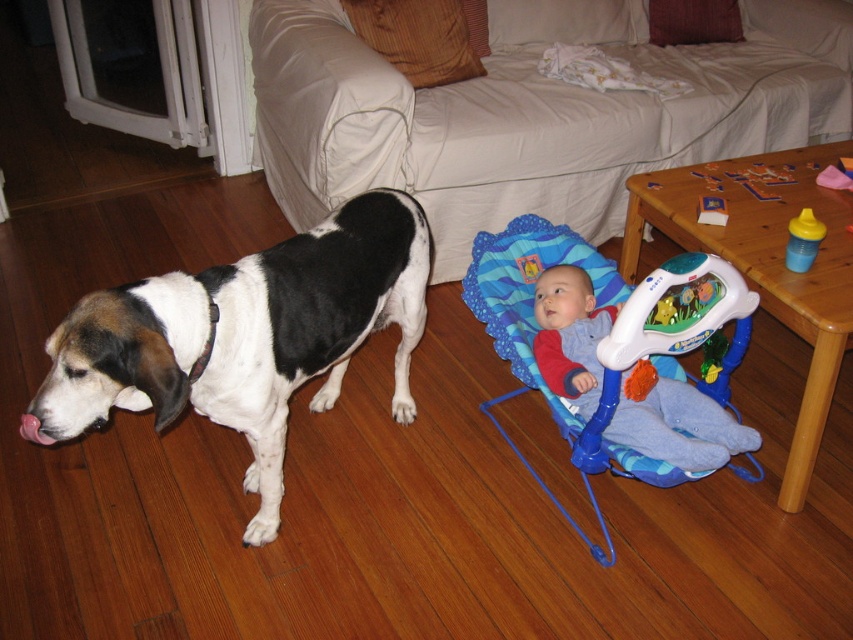
Who is taller, blue plastic baby carrier at lower center or blue plush baby seat at lower right?

blue plastic baby carrier at lower center

Based on the photo, which is more to the left, blue plastic baby carrier at lower center or blue plush baby seat at lower right?

blue plastic baby carrier at lower center is more to the left.

Looking at this image, who is more distant from viewer, (556, 413) or (592, 388)?

The point (556, 413) is more distant.

Locate an element on the screen. blue plastic baby carrier at lower center is located at coordinates (532, 317).

Is blue plush baby seat at lower right below yellow plastic sippy cup at right?

Correct, blue plush baby seat at lower right is located below yellow plastic sippy cup at right.

Does point (633, 433) come behind point (793, 224)?

No, it is in front of (793, 224).

Is point (630, 444) positioned after point (816, 225)?

No, (630, 444) is in front of (816, 225).

You are a GUI agent. You are given a task and a screenshot of the screen. Output one action in this format:
    pyautogui.click(x=<x>, y=<y>)
    Task: Click on the blue plush baby seat at lower right
    The image size is (853, 640).
    Given the screenshot: What is the action you would take?
    pyautogui.click(x=679, y=426)

Does point (233, 336) come farther from viewer compared to point (695, 465)?

No, (233, 336) is in front of (695, 465).

Is point (219, 324) positioned before point (590, 372)?

Yes, it is in front of point (590, 372).

Find the location of a particular element. This screenshot has width=853, height=640. black and white fur at left is located at coordinates (245, 337).

At what (x,y) coordinates should I click in order to perform the action: click on black and white fur at left. Please return your answer as a coordinate pair (x, y). Looking at the image, I should click on [x=245, y=337].